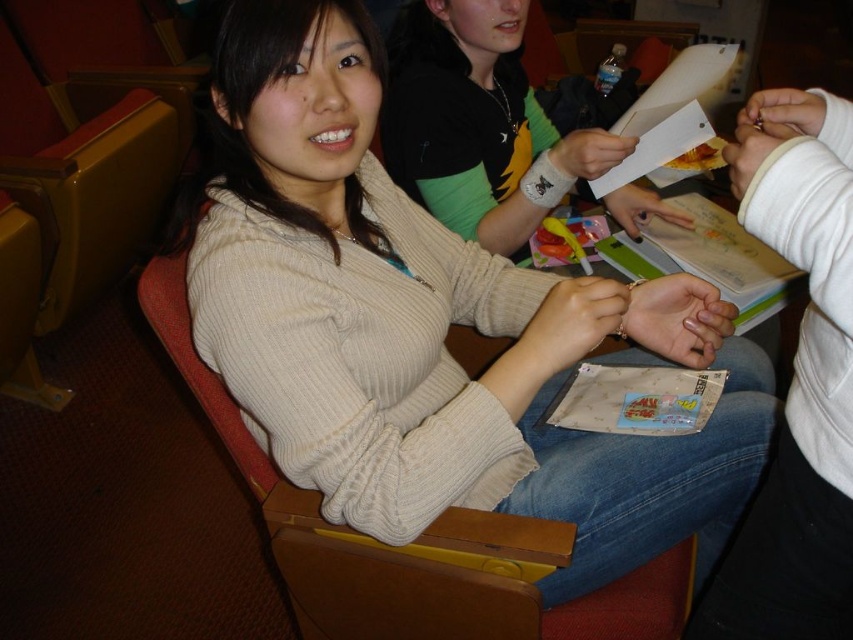
From the picture: Can you confirm if beige knit sweater at center is shorter than white sweater at center?

No.

Based on the photo, does beige knit sweater at center have a lesser width compared to white sweater at center?

No, beige knit sweater at center is not thinner than white sweater at center.

Locate an element on the screen. Image resolution: width=853 pixels, height=640 pixels. beige knit sweater at center is located at coordinates (431, 324).